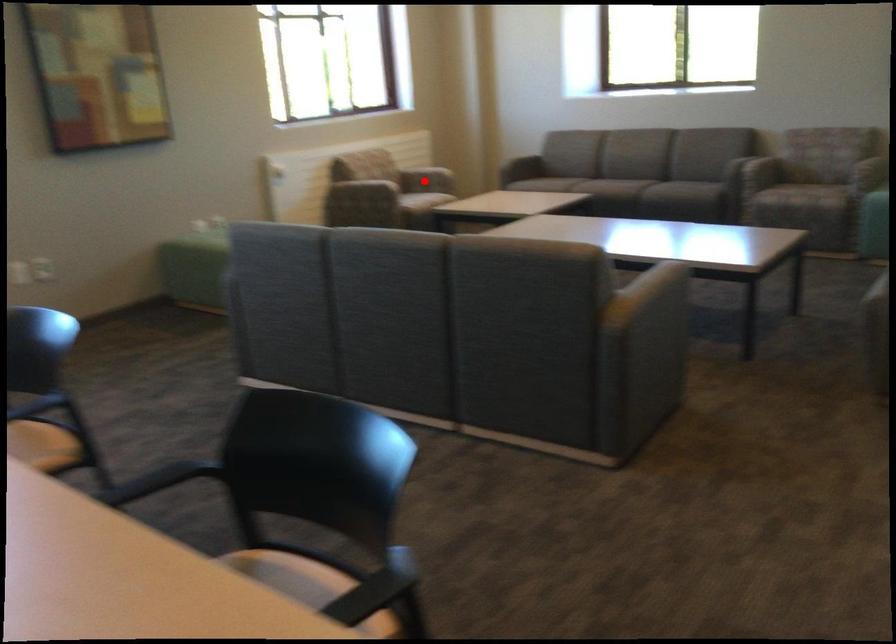
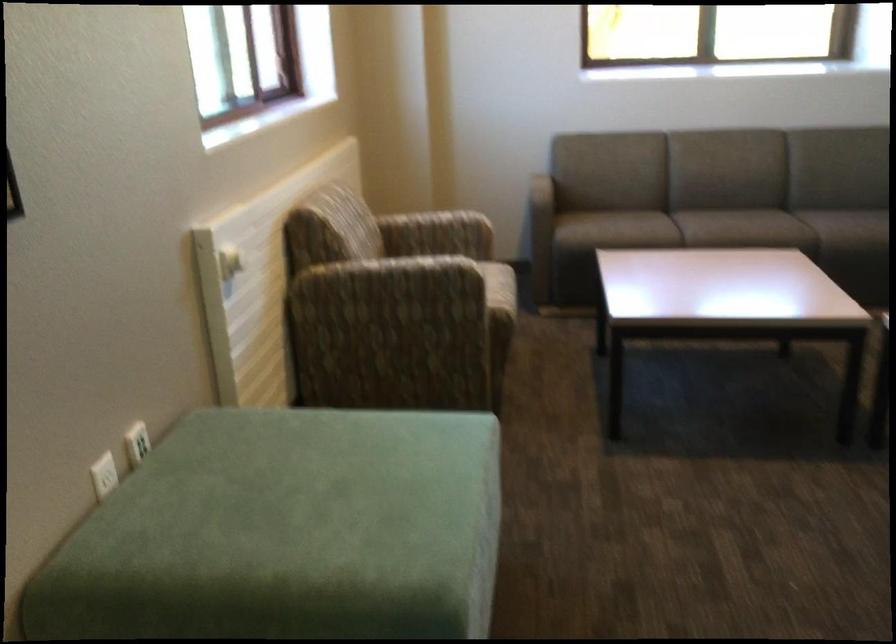
Question: A red point is marked in image1. In image2, is the corresponding 3D point closer to the camera or farther? Reply with the corresponding letter.

Choices:
 (A) The corresponding 3D point is closer.
 (B) The corresponding 3D point is farther.

Answer: (A)